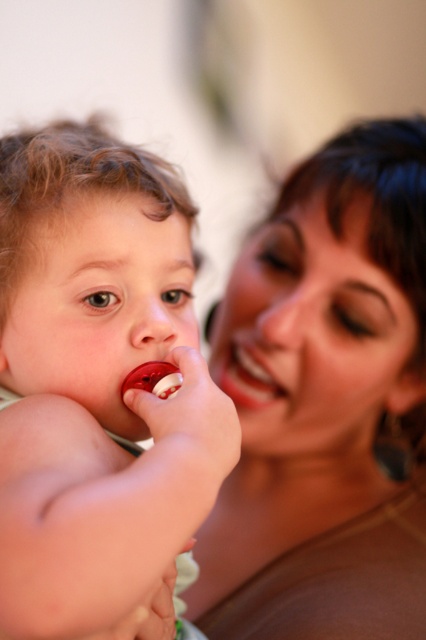
You are a photographer who wants to ensure the subject of the photo is clear. Given the scene, which object is closer to the camera between the rubber pacifier at left and the smooth matte lips at center?

The rubber pacifier at left is closer to the camera because it is in front of the smooth matte lips at center.

You are a photographer analyzing the image. You need to determine which object occupies more space in the frame between the smooth skin face at upper right and the rubber pacifier at left. Based on the scene description, which one is wider?

The smooth skin face at upper right is wider than the rubber pacifier at left according to the description.